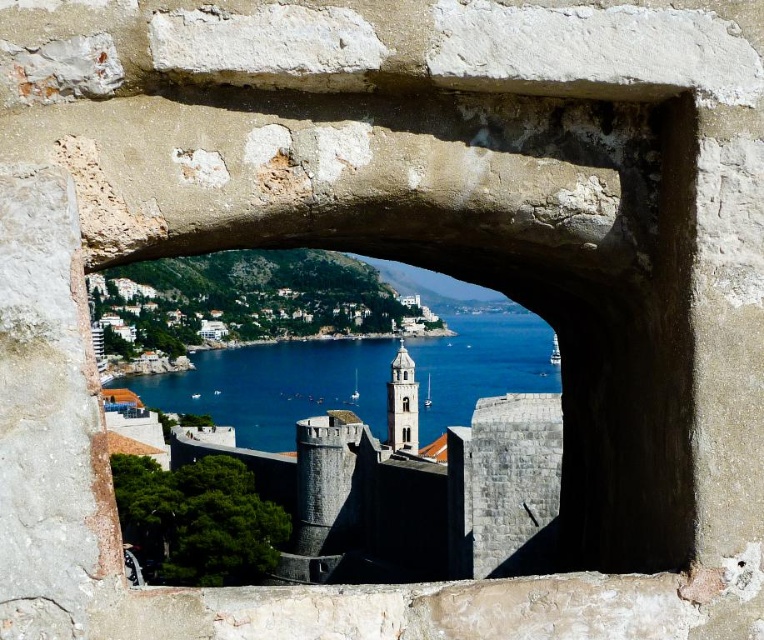
In the scene shown: Who is more forward, (x=402, y=404) or (x=406, y=372)?

Positioned in front is point (x=402, y=404).

Which is more to the left, transparent glass window at center or clear glass bell tower at center?

Positioned to the left is clear glass bell tower at center.

What do you see at coordinates (405, 403) in the screenshot?
I see `transparent glass window at center` at bounding box center [405, 403].

Where is `transparent glass window at center`? This screenshot has height=640, width=764. transparent glass window at center is located at coordinates (405, 403).

Does blue water at center appear on the right side of white stone tower at center?

Incorrect, blue water at center is not on the right side of white stone tower at center.

Between blue water at center and white stone tower at center, which one has less height?

Standing shorter between the two is white stone tower at center.

Is point (423, 412) positioned in front of point (416, 448)?

No, it is not.

Find the location of a particular element. The width and height of the screenshot is (764, 640). blue water at center is located at coordinates (274, 387).

Between clear glass window at center and clear glass bell tower at center, which one appears on the right side from the viewer's perspective?

clear glass window at center is more to the right.

Is clear glass window at center thinner than clear glass bell tower at center?

Incorrect, clear glass window at center's width is not less than clear glass bell tower at center's.

At what (x,y) coordinates should I click in order to perform the action: click on clear glass window at center. Please return your answer as a coordinate pair (x, y). Looking at the image, I should click on (405, 435).